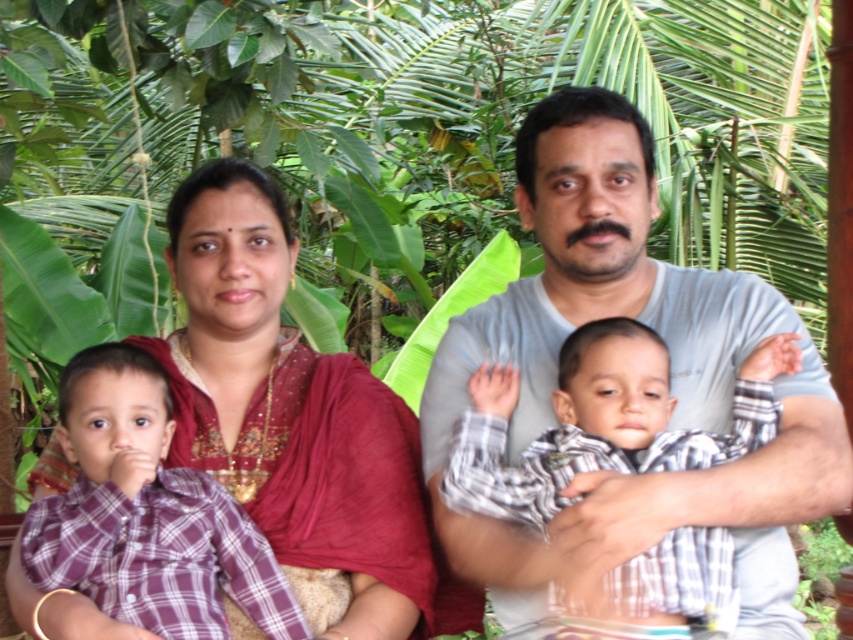
You are a photographer setting up for a family portrait. The family is currently seated with the matte red saree at center and the plaid cotton shirt at center. You need to position them closer so that the distance between the two is exactly 40 centimeters. How much centimeters should you move one of them towards the other?

The current distance between the matte red saree at center and the plaid cotton shirt at center is 56.39 centimeters. To reduce this to 40 centimeters, you need to decrease the distance by 16.39 centimeters. Moving one of them towards the other by approximately 8.195 centimeters would achieve the desired 40 centimeter separation. Alternatively, moving one by 16.39 centimeters while keeping the other stationary would also work, but the first method maintains symmetry.

You are a photographer trying to capture the family in this image. You notice the matte red saree at center and the plaid cotton shirt at center. Which clothing item is positioned higher relative to the other?

The matte red saree at center is above the plaid cotton shirt at center, so the matte red saree at center is positioned higher.